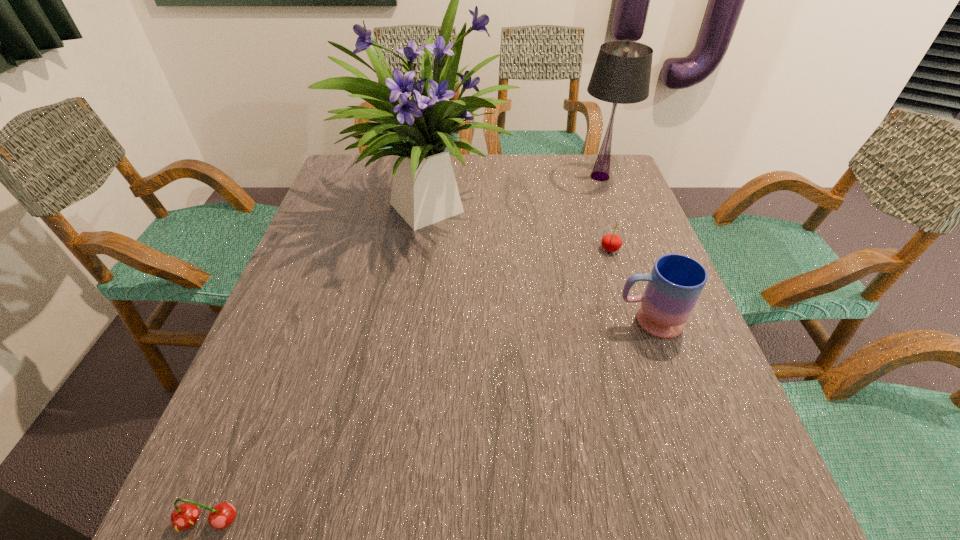
Where is `the tallest object`? The width and height of the screenshot is (960, 540). the tallest object is located at coordinates (424, 191).

Where is `the fourth shortest object`? The image size is (960, 540). the fourth shortest object is located at coordinates (621, 75).

Where is `mug`? This screenshot has width=960, height=540. mug is located at coordinates point(676,281).

At what (x,y) coordinates should I click in order to perform the action: click on the fourth farthest object. Please return your answer as a coordinate pair (x, y). Image resolution: width=960 pixels, height=540 pixels. Looking at the image, I should click on (676, 281).

The image size is (960, 540). Identify the location of the farther cherry. (610, 242).

You are a GUI agent. You are given a task and a screenshot of the screen. Output one action in this format:
    pyautogui.click(x=<x>, y=<y>)
    Task: Click on the nearer cherry
    
    Given the screenshot: What is the action you would take?
    pyautogui.click(x=184, y=516)

Locate an element on the screen. the nearest object is located at coordinates point(184,516).

The width and height of the screenshot is (960, 540). I want to click on vacant point located 0.340m on the right of the tallest object, so click(x=636, y=201).

This screenshot has height=540, width=960. Identify the location of free location located 0.110m on the front-facing side of the fourth shortest object. (538, 177).

Where is `free spot located on the front-facing side of the fourth shortest object`? This screenshot has width=960, height=540. free spot located on the front-facing side of the fourth shortest object is located at coordinates (461, 177).